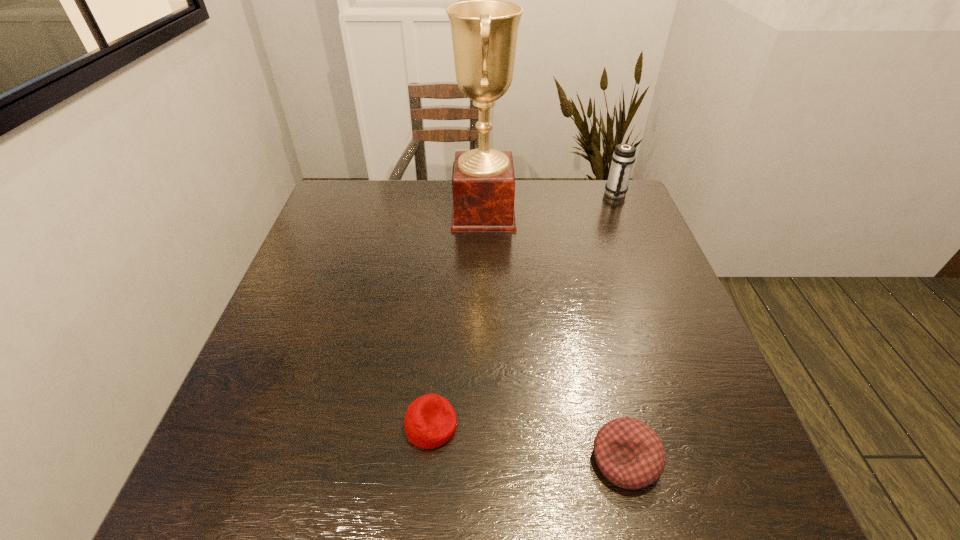
This screenshot has height=540, width=960. Identify the location of vacant region at the far left corner of the desktop. (331, 209).

In the image, there is a desktop. Where is `vacant space at the near left corner`? The height and width of the screenshot is (540, 960). vacant space at the near left corner is located at coordinates (282, 503).

In the image, there is a desktop. Where is `vacant space at the far right corner`? vacant space at the far right corner is located at coordinates (639, 222).

Find the location of a particular element. vacant area that lies between the tallest object and the second shortest object is located at coordinates (554, 336).

Find the location of a particular element. Image resolution: width=960 pixels, height=540 pixels. free space between the left beanbag and the rightmost object is located at coordinates (523, 310).

You are a GUI agent. You are given a task and a screenshot of the screen. Output one action in this format:
    pyautogui.click(x=<x>, y=<y>)
    Task: Click on the unoccupied area between the right beanbag and the thermos bottle
    The width and height of the screenshot is (960, 540).
    Given the screenshot: What is the action you would take?
    pyautogui.click(x=620, y=327)

This screenshot has height=540, width=960. What are the coordinates of `vacant area that lies between the taller beanbag and the tallest object` in the screenshot? It's located at (554, 336).

At what (x,y) coordinates should I click in order to perform the action: click on free spot between the trophy cup and the right beanbag. Please return your answer as a coordinate pair (x, y). This screenshot has width=960, height=540. Looking at the image, I should click on (554, 336).

This screenshot has height=540, width=960. What are the coordinates of `free space between the left beanbag and the second object from right to left` in the screenshot? It's located at (528, 442).

At what (x,y) coordinates should I click in order to perform the action: click on free space between the shorter beanbag and the thermos bottle. Please return your answer as a coordinate pair (x, y). Looking at the image, I should click on (523, 310).